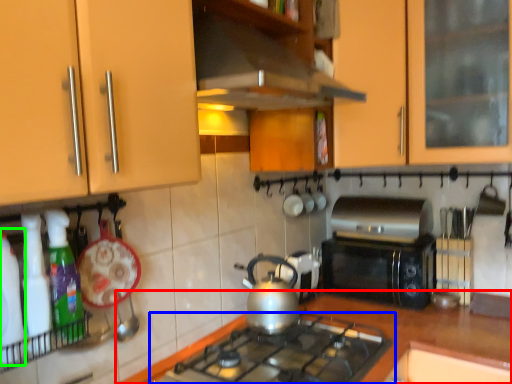
Question: Which is farther away from countertop (highlighted by a red box)? gas stove (highlighted by a blue box) or bottle (highlighted by a green box)?

Choices:
 (A) gas stove
 (B) bottle

Answer: (B)